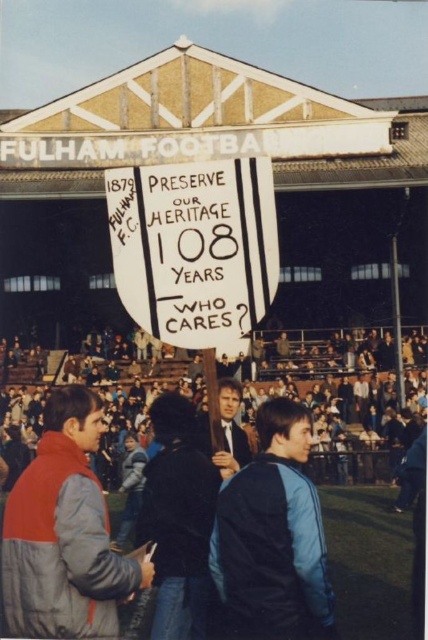
You are a photographer at the stadium and want to capture both the dark gray clothing at lower center and the blue fabric jacket at center in a single frame. Based on their sizes, which object should you focus on to ensure both are in the frame without cropping?

Since the dark gray clothing at lower center is wider than the blue fabric jacket at center, you should focus on the dark gray clothing at lower center to ensure both fit within the frame.

You are a photographer at the stadium and want to capture both the gray down jacket at lower left and the blue fabric jacket at center in a single shot. Which jacket should you position your camera closer to in order to include both in the frame?

You should position your camera closer to the gray down jacket at lower left since it is on the left side of the blue fabric jacket at center, allowing both to be captured in the frame when centered appropriately.

You are a photographer at the stadium and want to capture both the dark gray clothing at lower center and the blue fabric jacket at center in a single photo. Which person should be positioned closer to the camera to ensure both are in focus?

The blue fabric jacket at center is behind dark gray clothing at lower center, so to ensure both are in focus, the dark gray clothing at lower center should be positioned closer to the camera.